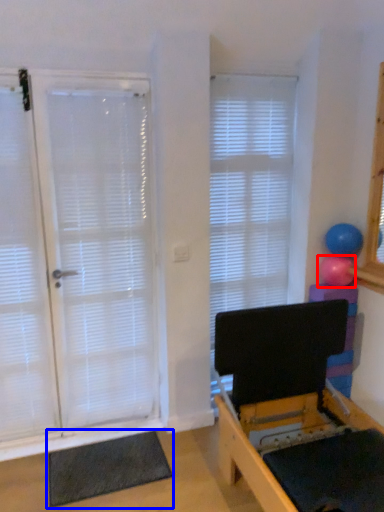
Question: Which object appears farthest to the camera in this image, ball (highlighted by a red box) or yoga mat (highlighted by a blue box)?

Choices:
 (A) ball
 (B) yoga mat

Answer: (A)